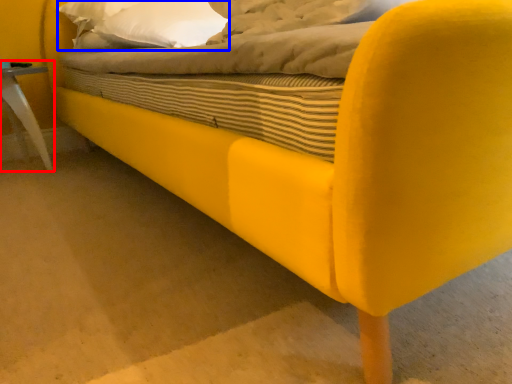
Question: Which of the following is the farthest to the observer, furniture (highlighted by a red box) or pillow (highlighted by a blue box)?

Choices:
 (A) furniture
 (B) pillow

Answer: (A)